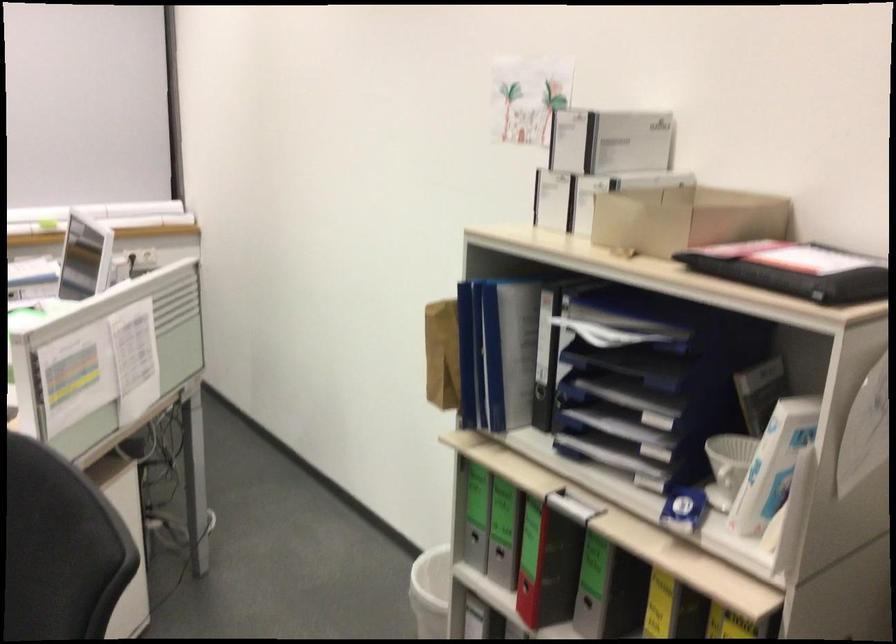
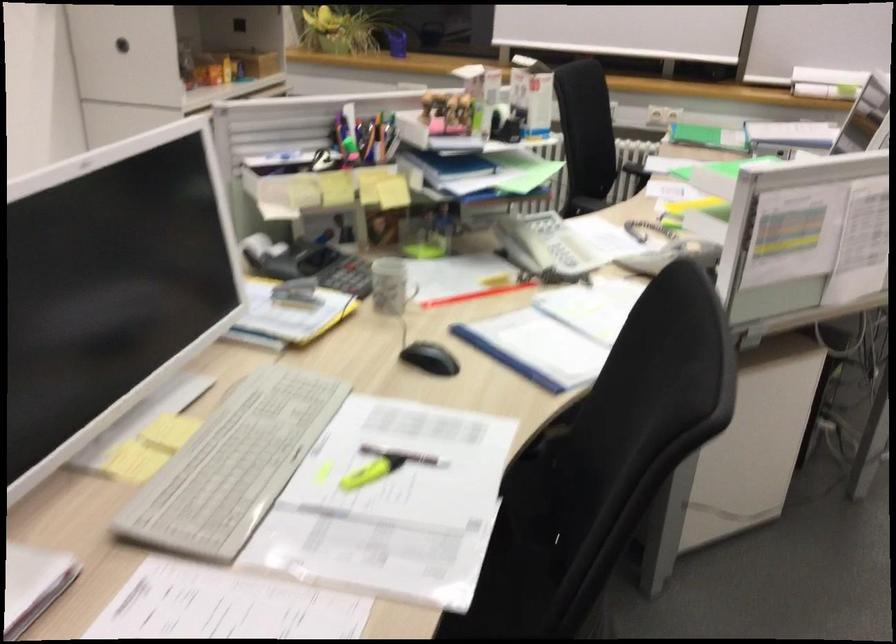
Question: How did the camera likely rotate?

Choices:
 (A) Left
 (B) Right
 (C) Up
 (D) Down

Answer: (A)